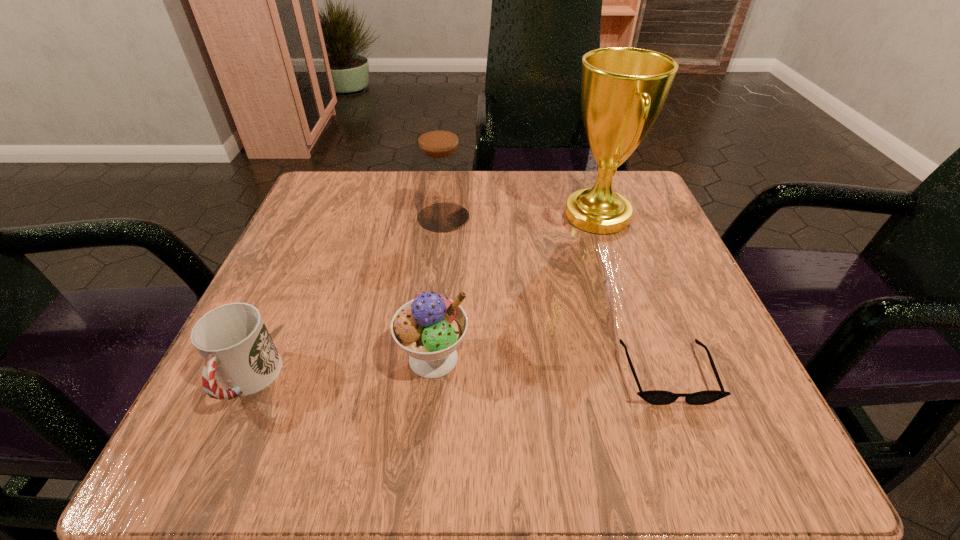
Find the location of a particular element. object located at the near left corner is located at coordinates (233, 341).

Locate an element on the screen. The width and height of the screenshot is (960, 540). object present at the far right corner is located at coordinates (623, 89).

Locate an element on the screen. This screenshot has width=960, height=540. object that is at the near right corner is located at coordinates (656, 397).

Image resolution: width=960 pixels, height=540 pixels. I want to click on blank space at the far edge, so click(389, 210).

The height and width of the screenshot is (540, 960). In order to click on vacant region at the left edge of the desktop in this screenshot , I will do `click(295, 298)`.

Where is `free location at the right edge`? The height and width of the screenshot is (540, 960). free location at the right edge is located at coordinates (678, 284).

I want to click on free space at the far left corner, so click(338, 187).

Where is `vacant position at the far right corner of the desktop`? Image resolution: width=960 pixels, height=540 pixels. vacant position at the far right corner of the desktop is located at coordinates (668, 234).

I want to click on free space between the leftmost object and the third tallest object, so click(340, 369).

Where is `unoccupied position between the shortest object and the fourth shortest object`? unoccupied position between the shortest object and the fourth shortest object is located at coordinates (555, 295).